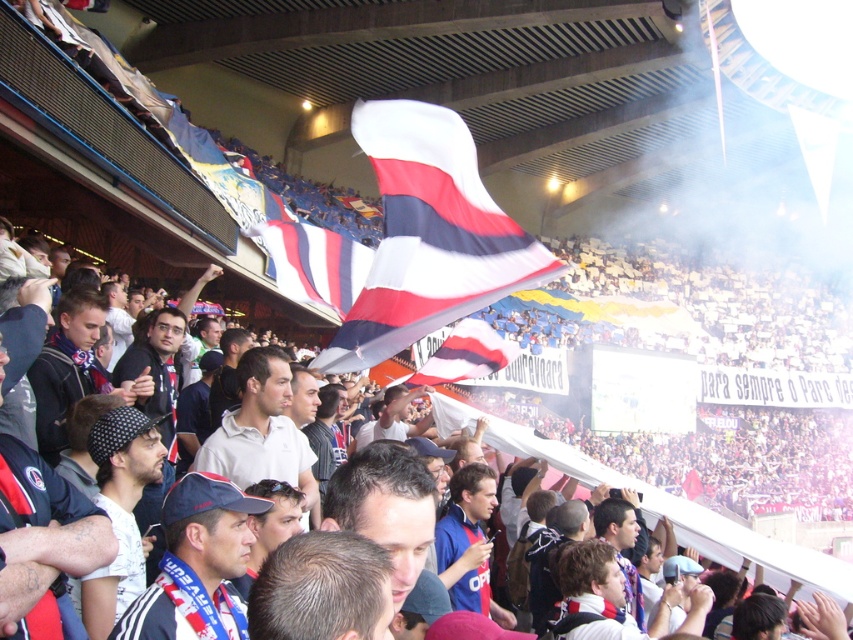
You are a photographer trying to capture a clear shot of the white matte shirt at center. However, the white fabric flag at upper center is obstructing your view. Can you estimate if the flag is tall enough to completely block the shirt from your camera lens?

The white fabric flag at upper center is much taller than the white matte shirt at center, so it is likely blocking the entire shirt from view.